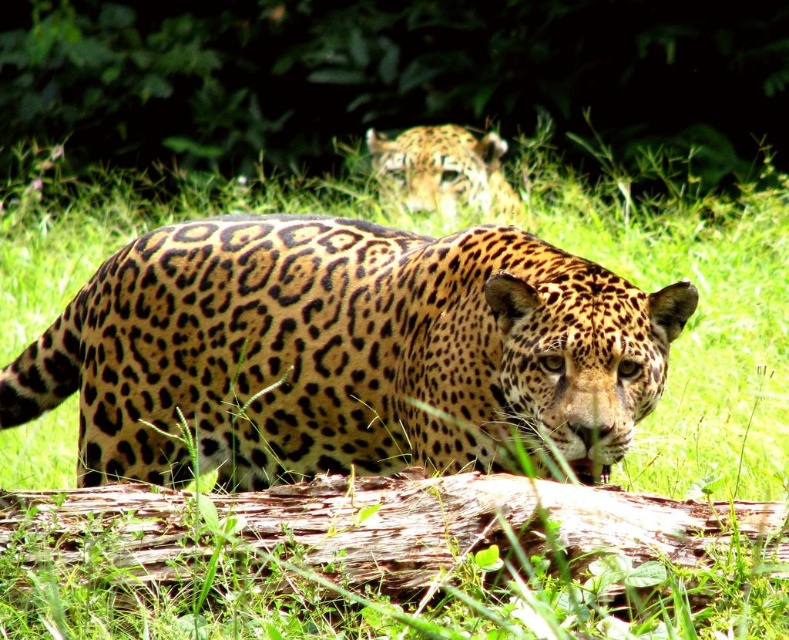
Consider the image. You are a wildlife photographer trying to capture the jaguar in the image. You notice two jaguars in the scene. Which jaguar, the spotted fur jaguar at center or the spotted fur jaguar at upper center, is taller?

The spotted fur jaguar at center is much taller than the spotted fur jaguar at upper center.

You are a wildlife photographer trying to capture the jaguar in the image. You have a camera with a zoom lens that can focus on objects up to 2 meters away. The distance between you and the spotted fur jaguar at center is 1.8 meters, while the distance to the spotted fur jaguar at upper center is 2.5 meters. Can your camera capture both jaguars clearly?

The spotted fur jaguar at center is within the camera range since it is 1.8 meters away, but the spotted fur jaguar at upper center is 2.5 meters away, which is beyond the camera range. Therefore, only the spotted fur jaguar at center can be captured clearly.

Based on the photo, you are a wildlife photographer trying to capture a clear image of the jaguar. You notice two jaguars in the scene. Which one is closer to the camera, the spotted fur jaguar at center or the spotted fur jaguar at upper center?

The spotted fur jaguar at center is closer to the camera because it is in front of the spotted fur jaguar at upper center.